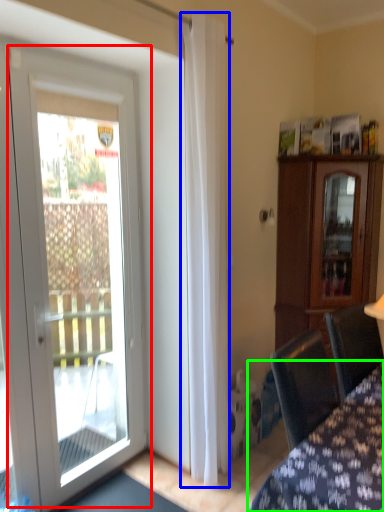
Question: Which object is positioned farthest from door (highlighted by a red box)? Select from curtain (highlighted by a blue box) and furniture (highlighted by a green box).

Choices:
 (A) curtain
 (B) furniture

Answer: (B)